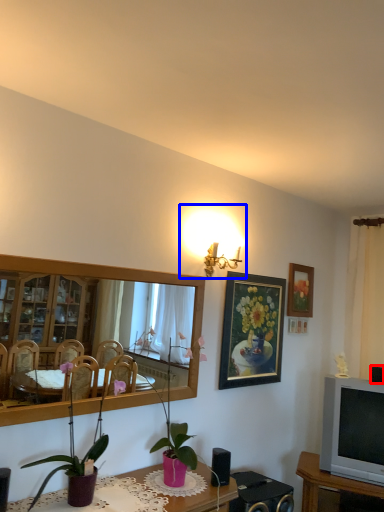
Question: Among these objects, which one is farthest to the camera, speaker (highlighted by a red box) or light fixture (highlighted by a blue box)?

Choices:
 (A) speaker
 (B) light fixture

Answer: (A)